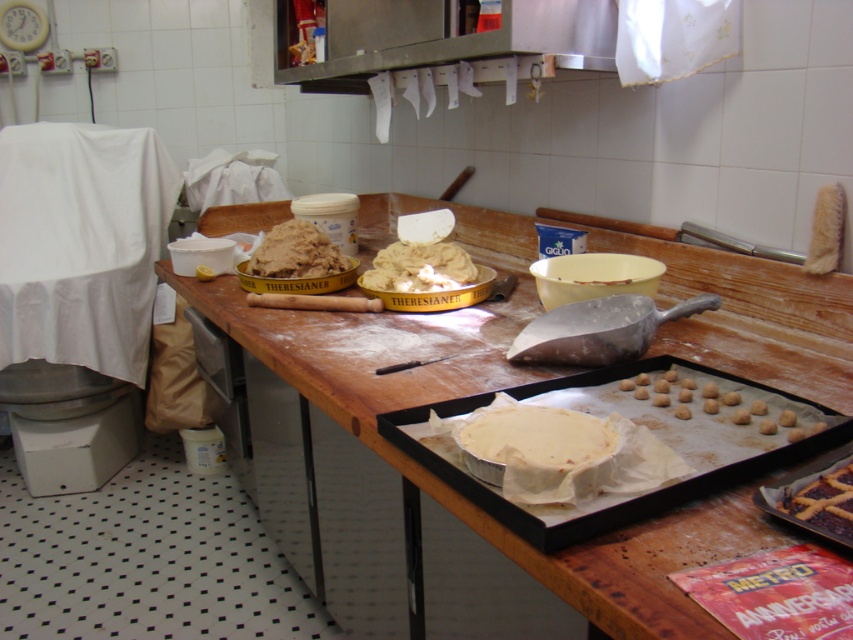
You are a baker who needs to place a new ingredient between the white matte pie at center and the brown crumbly dough at center. The ingredient container is 1.5 feet wide. Can you fit it there?

The distance between the white matte pie at center and the brown crumbly dough at center is 3.40 feet. Since the container is 1.5 feet wide, there is enough space to fit it between them.

You are a baker who needs to access the brown crumbly dough at center. Is the white matte pie at center blocking your direct path to it?

The white matte pie at center is in front of the brown crumbly dough at center, so yes, the pie is blocking the direct path to the dough.

You are organizing the kitchen workspace and need to place a new item on the matte silver tray at center. Where exactly should you position it to ensure it doesn not interfere with the existing items around it?

The matte silver tray at center is located at point (637, 422), so you should position the new item near this coordinate to avoid interfering with other items.